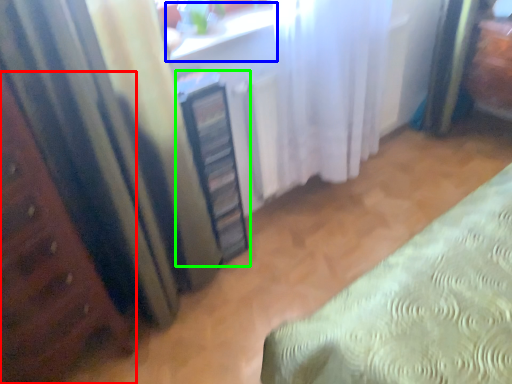
Question: Based on their relative distances, which object is farther from furniture (highlighted by a red box)? Choose from window sill (highlighted by a blue box) and cabinetry (highlighted by a green box).

Choices:
 (A) window sill
 (B) cabinetry

Answer: (A)